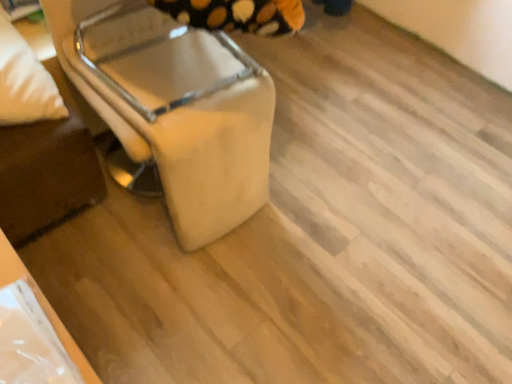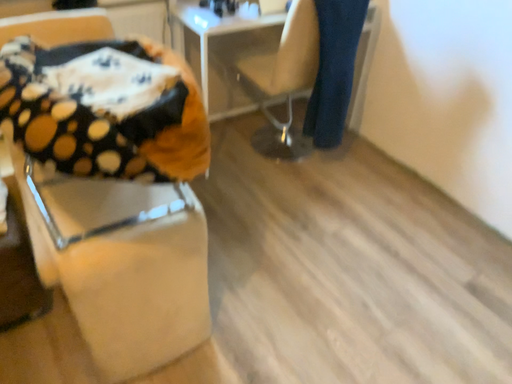
Question: Which way did the camera rotate in the video?

Choices:
 (A) rotated upward
 (B) rotated downward

Answer: (A)